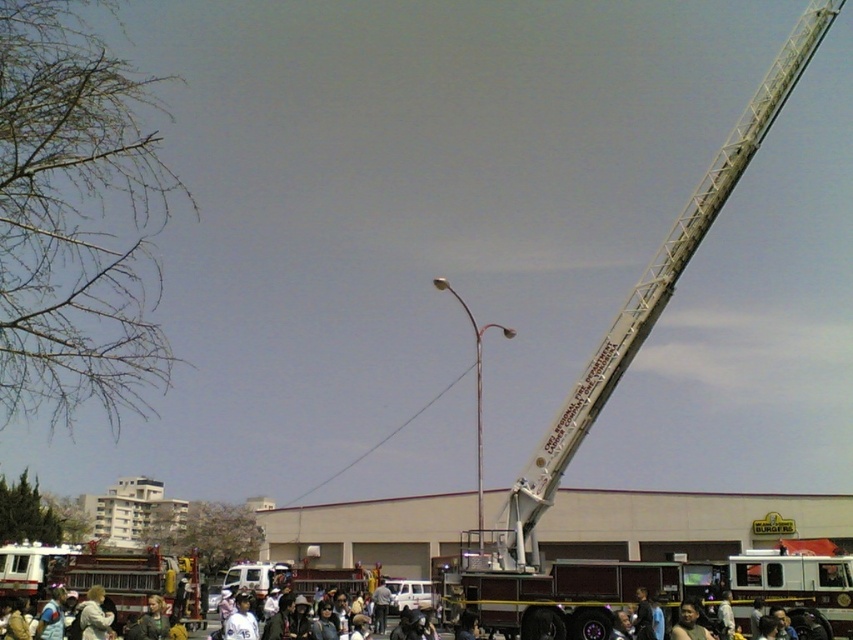
Is brushed metal fire truck at lower left to the left of white fabric jacket at lower center from the viewer's perspective?

Yes, brushed metal fire truck at lower left is to the left of white fabric jacket at lower center.

Looking at this image, between brushed metal fire truck at lower left and white fabric jacket at lower center, which one is positioned lower?

brushed metal fire truck at lower left

Between point (4, 586) and point (86, 600), which one is positioned behind?

Point (4, 586)

The height and width of the screenshot is (640, 853). I want to click on brushed metal fire truck at lower left, so click(x=102, y=576).

Between white fabric jacket at lower center and dark brown leather jacket at lower center, which one is positioned lower?

white fabric jacket at lower center is lower down.

Is white fabric jacket at lower center further to the viewer compared to dark brown leather jacket at lower center?

Yes, it is behind dark brown leather jacket at lower center.

Locate an element on the screen. This screenshot has width=853, height=640. white fabric jacket at lower center is located at coordinates (94, 616).

Is point (798, 52) positioned after point (84, 632)?

Yes, it is.

Who is taller, metallic silver fire truck at center or white fabric jacket at lower center?

metallic silver fire truck at center is taller.

Who is more forward, (473, 570) or (80, 616)?

Point (473, 570)

In order to click on metallic silver fire truck at center in this screenshot , I will do `click(616, 372)`.